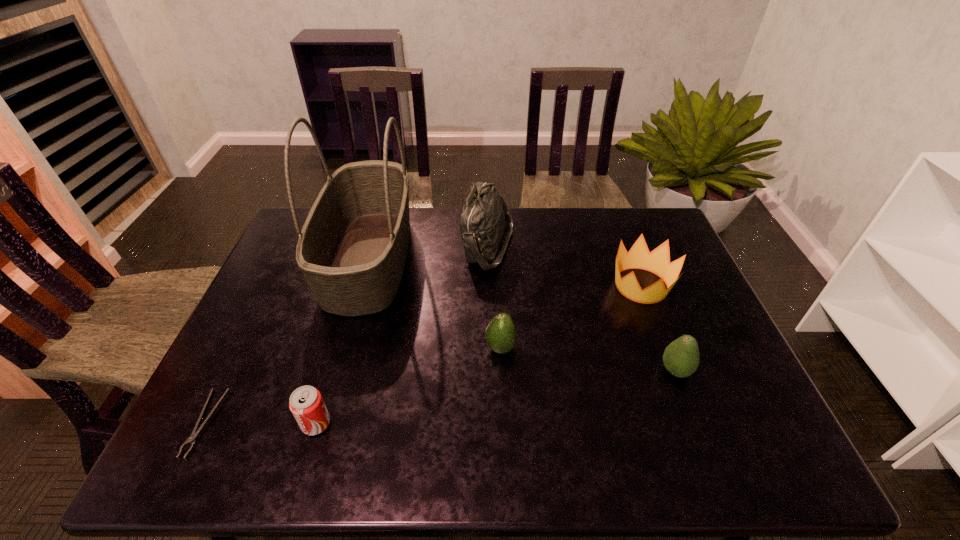
Locate an element on the screen. The image size is (960, 540). free region located 0.340m at the front padded panel of the shoulder bag is located at coordinates (358, 246).

You are a GUI agent. You are given a task and a screenshot of the screen. Output one action in this format:
    pyautogui.click(x=<x>, y=<y>)
    Task: Click on the vacant space situated at the front padded panel of the shoulder bag
    The height and width of the screenshot is (540, 960).
    Given the screenshot: What is the action you would take?
    pyautogui.click(x=358, y=246)

Identify the location of free space located 0.360m on the front of the crown. The height and width of the screenshot is (540, 960). (696, 429).

You are a GUI agent. You are given a task and a screenshot of the screen. Output one action in this format:
    pyautogui.click(x=<x>, y=<y>)
    Task: Click on the free location located 0.390m on the back of the right avocado
    
    Given the screenshot: What is the action you would take?
    tap(632, 258)

Image resolution: width=960 pixels, height=540 pixels. What are the coordinates of `vacant space located on the right of the left avocado` in the screenshot? It's located at (547, 348).

Where is `vacant space situated on the back of the soda can`? This screenshot has width=960, height=540. vacant space situated on the back of the soda can is located at coordinates (353, 297).

Image resolution: width=960 pixels, height=540 pixels. What are the coordinates of `blank area located on the right of the leftmost object` in the screenshot? It's located at (347, 423).

Where is `basket that is at the far edge`? The image size is (960, 540). basket that is at the far edge is located at coordinates (352, 250).

Where is `shoulder bag that is at the far edge`? The width and height of the screenshot is (960, 540). shoulder bag that is at the far edge is located at coordinates (485, 216).

I want to click on soda can at the near edge, so click(306, 403).